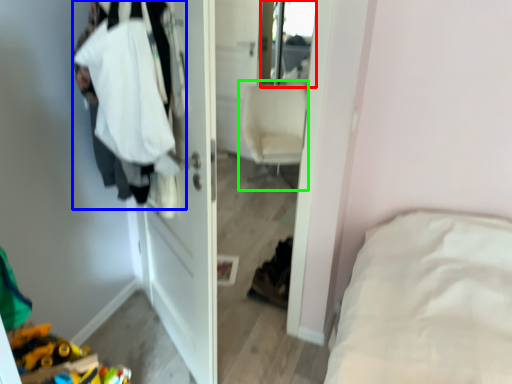
Question: Estimate the real-world distances between objects in this image. Which object is farther from mirror (highlighted by a red box), clothing (highlighted by a blue box) or chair (highlighted by a green box)?

Choices:
 (A) clothing
 (B) chair

Answer: (A)